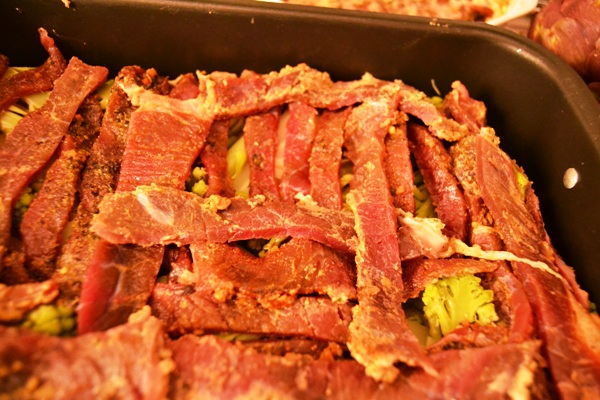
You are a GUI agent. You are given a task and a screenshot of the screen. Output one action in this format:
    pyautogui.click(x=<x>, y=<y>)
    Task: Click on the surface
    This screenshot has width=600, height=400.
    Given the screenshot: What is the action you would take?
    pyautogui.click(x=517, y=25)